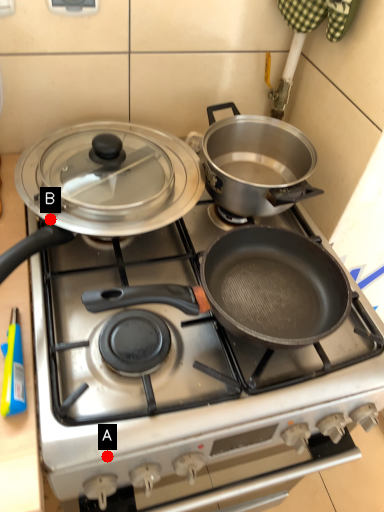
Question: Two points are circled on the image, labeled by A and B beside each circle. Which point is farther to the camera?

Choices:
 (A) A is further
 (B) B is further

Answer: (B)